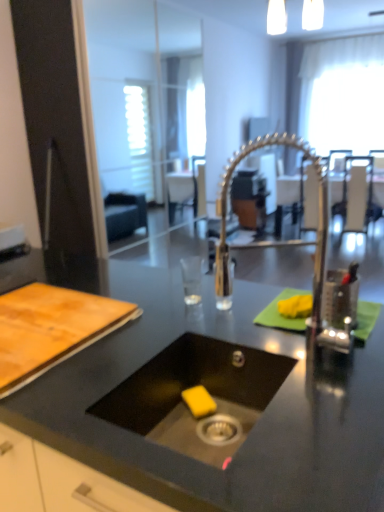
Question: Is metallic silver chair at upper center, the 2th chair positioned from the right, to the right of metallic silver chair at center, the third chair from the right, from the viewer's perspective?

Choices:
 (A) yes
 (B) no

Answer: (A)

Question: Considering the relative sizes of metallic silver chair at upper center, which is counted as the second chair, starting from the left, and metallic silver chair at center, the third chair from the right, in the image provided, is metallic silver chair at upper center, which is counted as the second chair, starting from the left, shorter than metallic silver chair at center, the third chair from the right,?

Choices:
 (A) no
 (B) yes

Answer: (A)

Question: Is metallic silver chair at upper center, which is counted as the second chair, starting from the left, positioned with its back to metallic silver chair at center, arranged as the 1th chair when viewed from the left?

Choices:
 (A) no
 (B) yes

Answer: (A)

Question: From the image's perspective, would you say metallic silver chair at upper center, the 2th chair positioned from the right, is shown under metallic silver chair at center, arranged as the 1th chair when viewed from the left?

Choices:
 (A) yes
 (B) no

Answer: (A)

Question: Is metallic silver chair at upper center, the 2th chair positioned from the right, wider than metallic silver chair at center, arranged as the 1th chair when viewed from the left?

Choices:
 (A) yes
 (B) no

Answer: (A)

Question: Is wooden cutting board at left bigger or smaller than white sheer curtain at upper right?

Choices:
 (A) small
 (B) big

Answer: (A)

Question: Considering the positions of wooden cutting board at left and white sheer curtain at upper right in the image, is wooden cutting board at left wider or thinner than white sheer curtain at upper right?

Choices:
 (A) thin
 (B) wide

Answer: (B)

Question: Is wooden cutting board at left taller or shorter than white sheer curtain at upper right?

Choices:
 (A) short
 (B) tall

Answer: (A)

Question: From a real-world perspective, is wooden cutting board at left physically located above or below white sheer curtain at upper right?

Choices:
 (A) above
 (B) below

Answer: (B)

Question: In terms of width, does polished metallic faucet at center look wider or thinner when compared to metallic silver chair at upper center, the 2th chair positioned from the right?

Choices:
 (A) thin
 (B) wide

Answer: (A)

Question: Is point (339, 331) closer or farther from the camera than point (304, 161)?

Choices:
 (A) farther
 (B) closer

Answer: (B)

Question: From the image's perspective, is polished metallic faucet at center above or below metallic silver chair at upper center, the 2th chair positioned from the right?

Choices:
 (A) below
 (B) above

Answer: (A)

Question: Is polished metallic faucet at center inside or outside of metallic silver chair at upper center, the 2th chair positioned from the right?

Choices:
 (A) inside
 (B) outside

Answer: (B)

Question: Is black matte sink at center wider or thinner than metallic silver table at center?

Choices:
 (A) wide
 (B) thin

Answer: (B)

Question: From their relative heights in the image, would you say black matte sink at center is taller or shorter than metallic silver table at center?

Choices:
 (A) tall
 (B) short

Answer: (B)